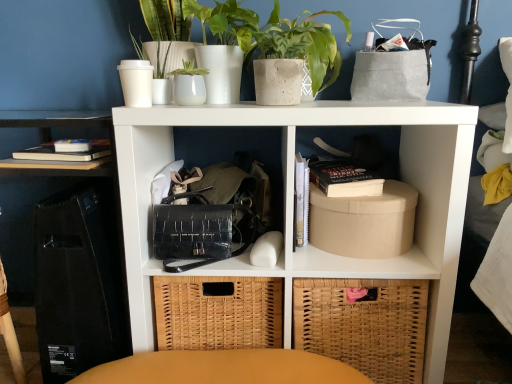
Question: Relative to hardcover black book at center-right, is white matte shelf at center, placed as the first shelf when sorted from bottom to top, in front or behind?

Choices:
 (A) front
 (B) behind

Answer: (A)

Question: Based on their positions, is white matte shelf at center, which is the 2th shelf from left to right, located to the left or right of hardcover black book at center-right?

Choices:
 (A) left
 (B) right

Answer: (A)

Question: Estimate the real-world distances between objects in this image. Which object is farther from the hardcover black book at center-right?

Choices:
 (A) white matte shelf at center, the second shelf from the top
 (B) woven brown basket at lower right
 (C) black crocodile-patterned handbag at center
 (D) beige cardboard box at right
 (E) hardcover books at left, the 2th shelf in the right-to-left sequence

Answer: (E)

Question: Estimate the real-world distances between objects in this image. Which object is farther from the speckled concrete pot at upper center?

Choices:
 (A) black crocodile-patterned handbag at center
 (B) woven brown basket at lower right
 (C) white matte shelf at center, the second shelf from the top
 (D) beige cardboard box at right
 (E) hardcover books at left, the 2th shelf in the right-to-left sequence

Answer: (B)